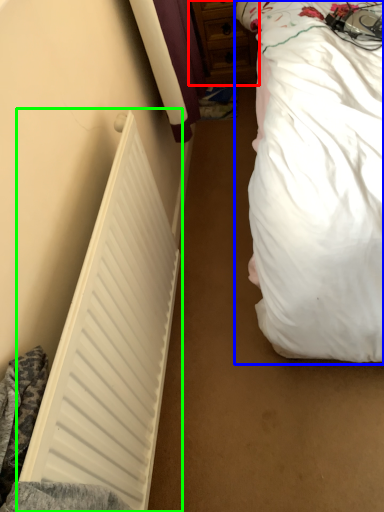
Question: Based on their relative distances, which object is nearer to dresser (highlighted by a red box)? Choose from bed (highlighted by a blue box) and radiator (highlighted by a green box).

Choices:
 (A) bed
 (B) radiator

Answer: (A)